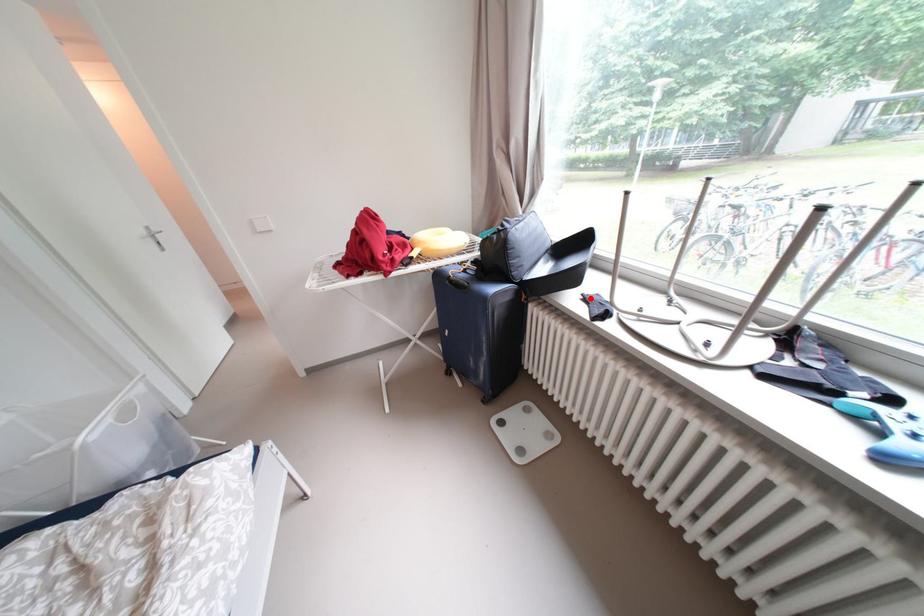
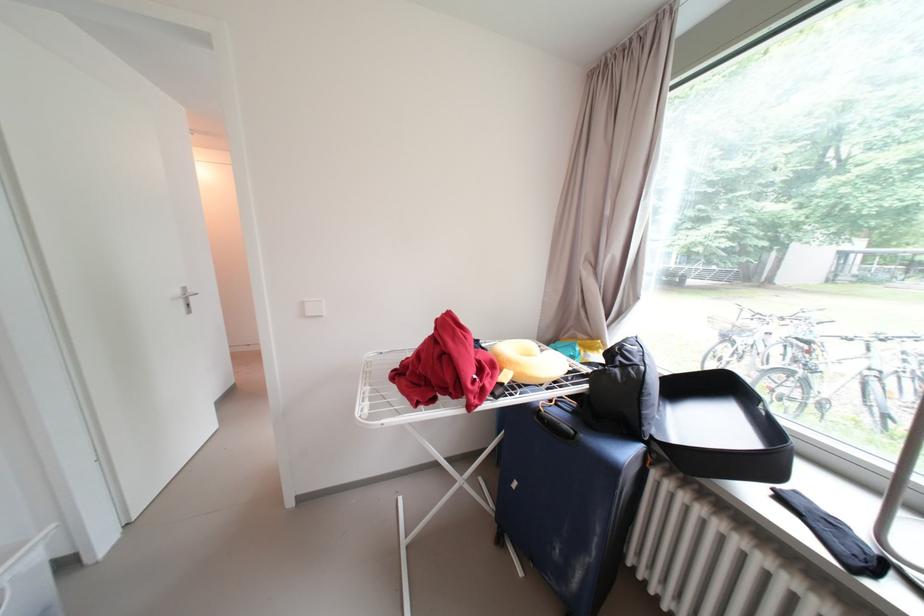
Locate, in the second image, the point that corresponds to the highlighted location in the first image.

(781, 493)